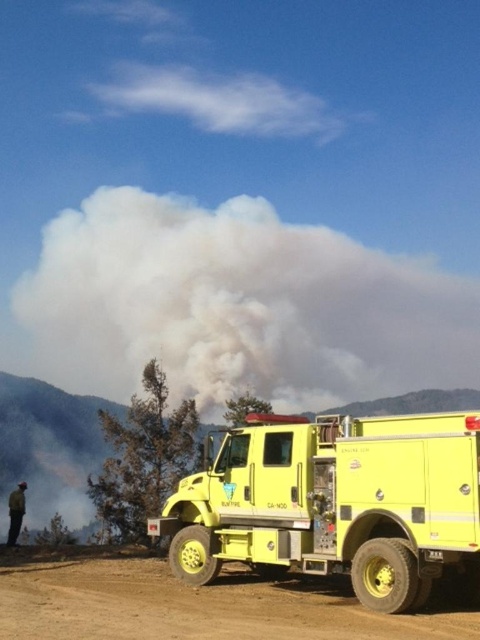
Question: Which point appears farthest from the camera in this image?

Choices:
 (A) (145, 596)
 (B) (215, 502)
 (C) (22, 486)

Answer: (C)

Question: Does brown dirt track at lower center have a greater width compared to camouflage jacket at lower left?

Choices:
 (A) yes
 (B) no

Answer: (B)

Question: Is yellow matte fire truck at center wider than brown dirt track at lower center?

Choices:
 (A) yes
 (B) no

Answer: (B)

Question: Can you confirm if brown dirt track at lower center is positioned to the left of camouflage jacket at lower left?

Choices:
 (A) no
 (B) yes

Answer: (A)

Question: Based on their relative distances, which object is farther from the brown dirt track at lower center?

Choices:
 (A) camouflage jacket at lower left
 (B) yellow matte fire truck at center

Answer: (A)

Question: Among these points, which one is nearest to the camera?

Choices:
 (A) (19, 515)
 (B) (456, 417)

Answer: (B)